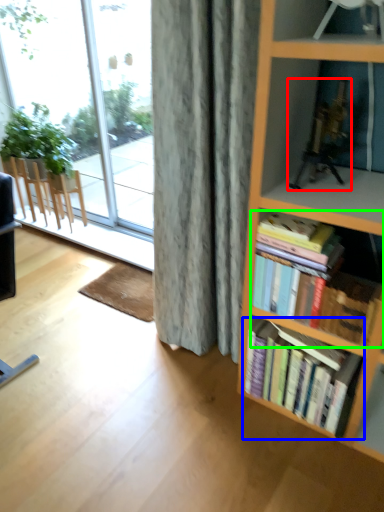
Question: Which object is positioned closest to toy (highlighted by a red box)? Select from book (highlighted by a blue box) and book (highlighted by a green box).

Choices:
 (A) book
 (B) book

Answer: (B)